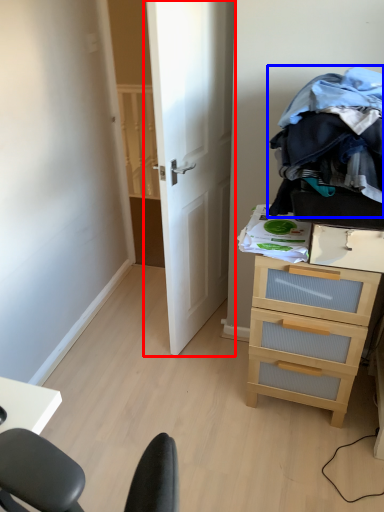
Question: Among these objects, which one is nearest to the camera, door (highlighted by a red box) or clothing (highlighted by a blue box)?

Choices:
 (A) door
 (B) clothing

Answer: (B)